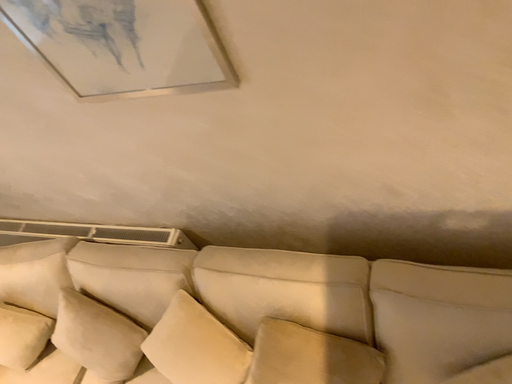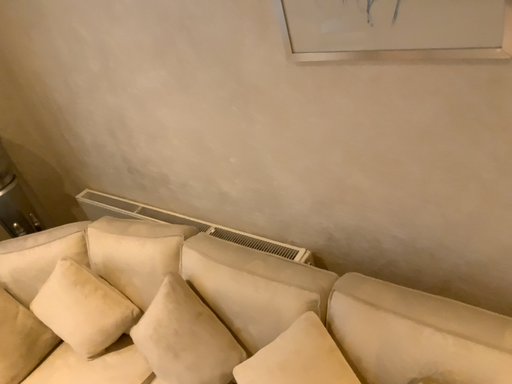
Question: Which way did the camera rotate in the video?

Choices:
 (A) rotated right
 (B) rotated left

Answer: (B)